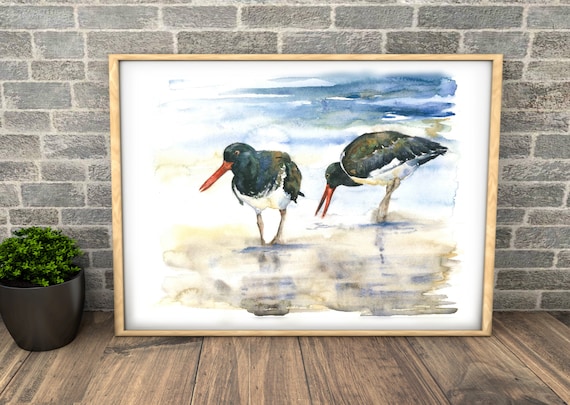
The image size is (570, 405). I want to click on wood slat, so click(x=83, y=368), click(x=266, y=376), click(x=487, y=363).